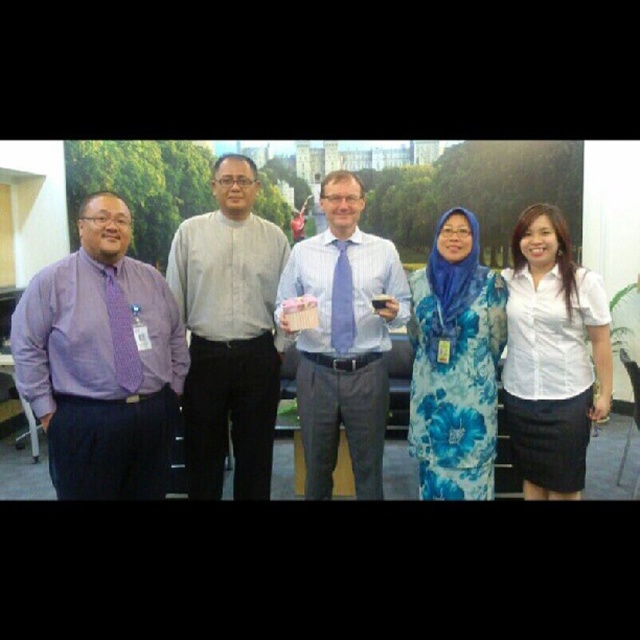
You are a photographer setting up for a group photo. You need to ensure that the white matte shirt at right and the matte blue tie at center are both visible in the frame. Based on their positions, which one is lower in the image?

The white matte shirt at right is positioned under the matte blue tie at center, so it is lower in the image.

You are standing in an office and see two points marked in the image. The first point is at coordinates point (x=157, y=403) and the second is at point (x=440, y=428). Which point is nearer to you?

Point (x=157, y=403) is closer to the viewer than point (x=440, y=428).

You are organizing a group photo and need to arrange the purple matte shirt at left and the blue floral dress at center so that both fit within a frame that can only accommodate a total width of 1.2 meters. Given their current widths, is this possible?

The purple matte shirt at left has a larger width than the blue floral dress at center. Since the total width of both would exceed 1.2 meters, arranging them within the frame is not possible.